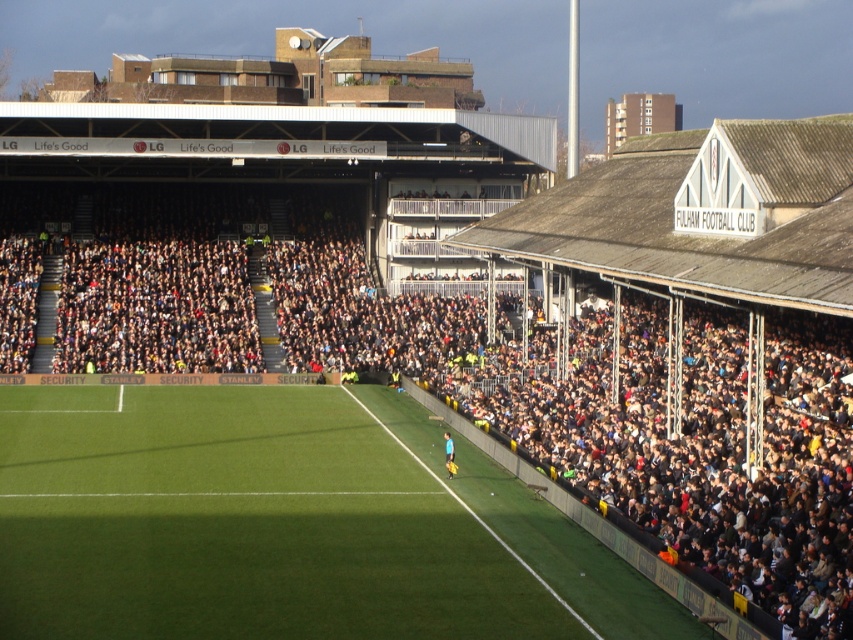
You are standing at the edge of the football pitch and want to reach the point marked at coordinates point [1,509]. Considering the distance, can you walk directly to it without any obstacles?

The point [1,509] is 137.42 feet away from the viewer. Since there are no obstacles mentioned in the scene description, you can walk directly to it.

In the scene shown: You are a photographer standing at the edge of the football pitch. You want to take a photo of the yellow jersey at center and the dark gray concrete stadium at upper center. According to the scene, which object should appear on the right side of the photo?

The yellow jersey at center should appear on the right side of the photo because the dark gray concrete stadium at upper center is to the left of it.

You are a drone operator trying to capture aerial footage of the stadium. From your current position above the dark gray concrete stadium at upper center, can you see the green artificial turf at center clearly?

The dark gray concrete stadium at upper center is in front of the green artificial turf at center, so the stadium structure may block the view of the green artificial turf at center from your current position above the dark gray concrete stadium at upper center.